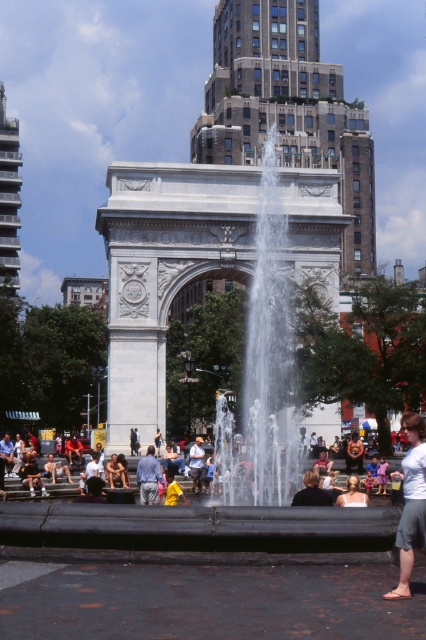
Question: Which point is closer to the camera?

Choices:
 (A) pos(397,477)
 (B) pos(293,26)
 (C) pos(155,483)
 (D) pos(170,497)

Answer: (D)

Question: Which point is closer to the camera taking this photo?

Choices:
 (A) (305, 484)
 (B) (189, 483)
 (C) (195, 461)

Answer: (A)

Question: From the image, what is the correct spatial relationship of gray cotton shorts at lower right in relation to yellow fabric at center?

Choices:
 (A) right
 (B) left

Answer: (A)

Question: Which is farther from the brown stone arch at center?

Choices:
 (A) light blue denim jacket at center
 (B) light brown leather jacket at lower center

Answer: (A)

Question: Is light brown leather jacket at lower center wider than yellow fabric at center?

Choices:
 (A) yes
 (B) no

Answer: (A)

Question: In this image, where is smooth concrete tower at left located relative to light blue denim jacket at center?

Choices:
 (A) above
 (B) below

Answer: (A)